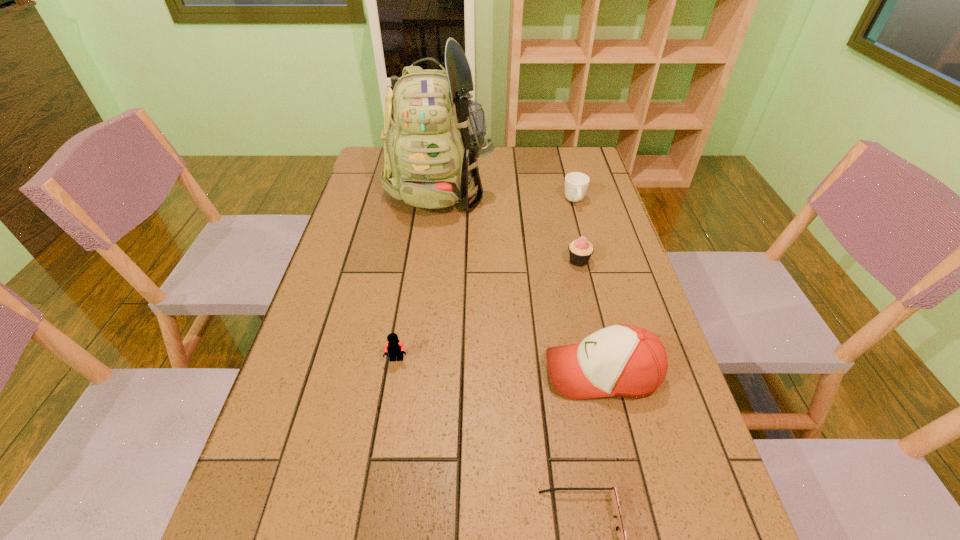
At what (x,y) coordinates should I click in order to perform the action: click on vacant area located 0.300m on the front-facing side of the Lego. Please return your answer as a coordinate pair (x, y). Looking at the image, I should click on (372, 508).

This screenshot has width=960, height=540. I want to click on vacant space located 0.380m with the handle on the side of the cup, so click(x=600, y=296).

The image size is (960, 540). Identify the location of object that is positioned at the far edge. (433, 135).

The width and height of the screenshot is (960, 540). Find the location of `object that is at the left edge`. object that is at the left edge is located at coordinates (433, 135).

The width and height of the screenshot is (960, 540). Identify the location of baseball cap that is at the right edge. (621, 360).

The height and width of the screenshot is (540, 960). What are the coordinates of `cupcake positioned at the right edge` in the screenshot? It's located at (580, 250).

At what (x,y) coordinates should I click in order to perform the action: click on cup that is at the right edge. Please return your answer as a coordinate pair (x, y). The height and width of the screenshot is (540, 960). Looking at the image, I should click on (576, 183).

Locate an element on the screen. object that is at the far left corner is located at coordinates 433,135.

Where is `free spot at the far edge of the desktop`? free spot at the far edge of the desktop is located at coordinates (509, 177).

Image resolution: width=960 pixels, height=540 pixels. Find the location of `vacant space at the left edge of the desktop`. vacant space at the left edge of the desktop is located at coordinates (346, 259).